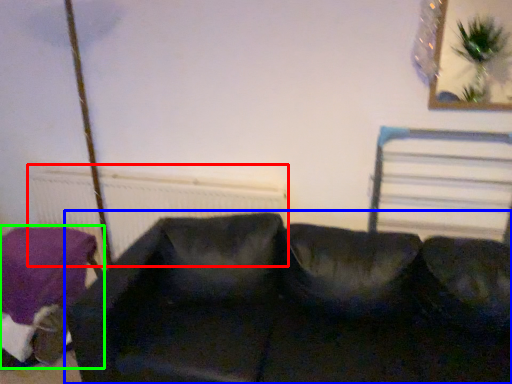
Question: Which object is the closest to the radiator (highlighted by a red box)? Choose among these: studio couch (highlighted by a blue box) or furniture (highlighted by a green box).

Choices:
 (A) studio couch
 (B) furniture

Answer: (B)